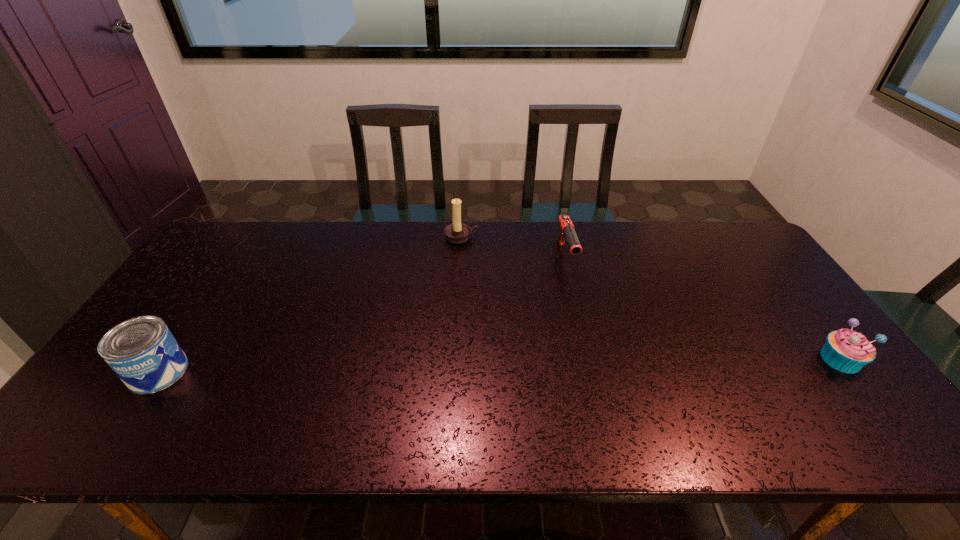
Where is `vacant point located between the second object from left to right and the gun`? The height and width of the screenshot is (540, 960). vacant point located between the second object from left to right and the gun is located at coordinates (514, 247).

Identify the location of unoccupied position between the third object from left to right and the candle holder. (514, 247).

This screenshot has height=540, width=960. I want to click on blank region between the muffin and the gun, so click(x=703, y=308).

Identify the location of free space between the can and the gun. The image size is (960, 540). (362, 314).

Where is `object that ranks as the second closest to the third object from left to right`? The image size is (960, 540). object that ranks as the second closest to the third object from left to right is located at coordinates (845, 350).

Locate an element on the screen. object that is the second closest to the rightmost object is located at coordinates (457, 232).

Identify the location of blank area in the image that satisfies the following two spatial constraints: 1. on the front side of the second object from left to right; 2. on the left side of the rightmost object. (455, 359).

Where is `vacant space that satisfies the following two spatial constraints: 1. on the front side of the second object from left to right; 2. on the left side of the gun`? The width and height of the screenshot is (960, 540). vacant space that satisfies the following two spatial constraints: 1. on the front side of the second object from left to right; 2. on the left side of the gun is located at coordinates (461, 256).